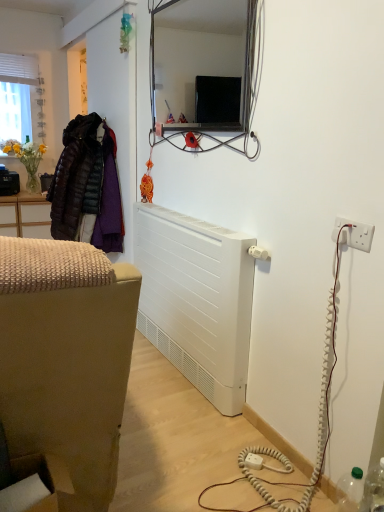
Describe the element at coordinates (87, 186) in the screenshot. This screenshot has height=512, width=384. I see `dark brown quilted jacket at left` at that location.

Find the location of a particular element. white plastic electrical outlet at right is located at coordinates (353, 234).

This screenshot has height=512, width=384. What do you see at coordinates (353, 234) in the screenshot? I see `white plastic electrical outlet at right` at bounding box center [353, 234].

This screenshot has width=384, height=512. Describe the element at coordinates (374, 489) in the screenshot. I see `transparent plastic bottle at lower right` at that location.

Describe the element at coordinates (196, 300) in the screenshot. I see `white matte radiator at lower center` at that location.

Describe the element at coordinates (253, 461) in the screenshot. I see `white plastic plug at lower center` at that location.

Where is `white plastic plug at lower center`? The width and height of the screenshot is (384, 512). white plastic plug at lower center is located at coordinates (253, 461).

Locate an element on the screen. This screenshot has width=384, height=512. dark brown quilted jacket at left is located at coordinates (87, 186).

Looking at this image, between white plastic plug at lower center and white matte radiator at lower center, which one has smaller width?

white plastic plug at lower center is thinner.

Is white plastic plug at lower center inside or outside of white matte radiator at lower center?

white plastic plug at lower center is located beyond the bounds of white matte radiator at lower center.

The height and width of the screenshot is (512, 384). Identify the location of plug that is under the white matte radiator at lower center (from a real-world perspective). (253, 461).

Between white matte radiator at lower center and white plastic plug at lower center, which one has more height?

white matte radiator at lower center is taller.

Measure the distance from white matte radiator at lower center to white plastic plug at lower center.

white matte radiator at lower center is 76.87 centimeters away from white plastic plug at lower center.

Considering the positions of objects white matte radiator at lower center and white plastic plug at lower center in the image provided, who is in front, white matte radiator at lower center or white plastic plug at lower center?

white matte radiator at lower center is closer to the camera.

From a real-world perspective, which object rests below the other?

From a 3D spatial view, white plastic plug at lower center is below.

Considering the positions of point (254, 460) and point (119, 238), is point (254, 460) closer or farther from the camera than point (119, 238)?

Point (254, 460) is closer to the camera than point (119, 238).

Is white plastic electrical outlet at right positioned far away from white plastic plug at lower center?

Actually, white plastic electrical outlet at right and white plastic plug at lower center are a little close together.

Is white plastic electrical outlet at right situated inside white plastic plug at lower center or outside?

white plastic electrical outlet at right is outside white plastic plug at lower center.

Can you confirm if white plastic electrical outlet at right is smaller than white plastic plug at lower center?

Incorrect, white plastic electrical outlet at right is not smaller in size than white plastic plug at lower center.

Visually, is white plastic electrical outlet at right positioned to the left or to the right of white plastic plug at lower center?

In the image, white plastic electrical outlet at right appears on the right side of white plastic plug at lower center.

Between white plastic electrical outlet at right and dark brown quilted jacket at left, which one has smaller size?

white plastic electrical outlet at right.

At what (x,y) coordinates should I click in order to perform the action: click on electric outlet in front of the dark brown quilted jacket at left. Please return your answer as a coordinate pair (x, y). The image size is (384, 512). Looking at the image, I should click on (353, 234).

Considering the sizes of objects white plastic electrical outlet at right and dark brown quilted jacket at left in the image provided, who is taller, white plastic electrical outlet at right or dark brown quilted jacket at left?

dark brown quilted jacket at left.

From the image's perspective, would you say white plastic electrical outlet at right is positioned over dark brown quilted jacket at left?

Actually, white plastic electrical outlet at right appears below dark brown quilted jacket at left in the image.

Can you tell me how much transparent plastic bottle at lower right and metallic frame mirror at upper center differ in facing direction?

There is a 0.0091-degree angle between the facing directions of transparent plastic bottle at lower right and metallic frame mirror at upper center.

In the scene shown: Are transparent plastic bottle at lower right and metallic frame mirror at upper center located far from each other?

transparent plastic bottle at lower right is positioned a significant distance from metallic frame mirror at upper center.

How distant is transparent plastic bottle at lower right from metallic frame mirror at upper center?

4.33 meters.

Considering the relative sizes of transparent plastic bottle at lower right and metallic frame mirror at upper center in the image provided, is transparent plastic bottle at lower right shorter than metallic frame mirror at upper center?

Yes, transparent plastic bottle at lower right is shorter than metallic frame mirror at upper center.

From a real-world perspective, is metallic frame mirror at upper center over white plastic electrical outlet at right?

Yes, from a real-world perspective, metallic frame mirror at upper center is above white plastic electrical outlet at right.

Which of these two, metallic frame mirror at upper center or white plastic electrical outlet at right, is smaller?

white plastic electrical outlet at right.

Which object is further away from the camera, metallic frame mirror at upper center or white plastic electrical outlet at right?

metallic frame mirror at upper center.

In the image, there is a white plastic electrical outlet at right. At what (x,y) coordinates should I click in order to perform the action: click on mirror above it (from the image's perspective). Please return your answer as a coordinate pair (x, y). The width and height of the screenshot is (384, 512). Looking at the image, I should click on (200, 65).

Where is `plug beneath the white matte radiator at lower center (from a real-world perspective)`? This screenshot has width=384, height=512. plug beneath the white matte radiator at lower center (from a real-world perspective) is located at coordinates (253, 461).

This screenshot has height=512, width=384. What are the coordinates of `radiator that is above the white plastic plug at lower center (from the image's perspective)` in the screenshot? It's located at (196, 300).

Looking at the image, which one is located further to white plastic plug at lower center, white matte radiator at lower center or dark brown quilted jacket at left?

dark brown quilted jacket at left.

Based on their spatial positions, is white matte radiator at lower center or metallic frame mirror at upper center closer to dark brown quilted jacket at left?

white matte radiator at lower center is positioned closer to the anchor dark brown quilted jacket at left.

Considering their positions, is white plastic electrical outlet at right positioned further to white plastic plug at lower center than white matte radiator at lower center?

white plastic electrical outlet at right is positioned further to the anchor white plastic plug at lower center.

Looking at the image, which one is located further to white plastic electrical outlet at right, metallic frame mirror at upper center or dark brown quilted jacket at left?

metallic frame mirror at upper center is further to white plastic electrical outlet at right.

Estimate the real-world distances between objects in this image. Which object is closer to white plastic electrical outlet at right, transparent plastic bottle at lower right or dark brown quilted jacket at left?

transparent plastic bottle at lower right lies closer to white plastic electrical outlet at right than the other object.

From the image, which object appears to be nearer to transparent plastic bottle at lower right, dark brown quilted jacket at left or white plastic electrical outlet at right?

The object closer to transparent plastic bottle at lower right is white plastic electrical outlet at right.

Considering their positions, is metallic frame mirror at upper center positioned closer to dark brown quilted jacket at left than white plastic plug at lower center?

metallic frame mirror at upper center is positioned closer to the anchor dark brown quilted jacket at left.

From the image, which object appears to be nearer to white plastic plug at lower center, transparent plastic bottle at lower right or white plastic electrical outlet at right?

Based on the image, transparent plastic bottle at lower right appears to be nearer to white plastic plug at lower center.

At what (x,y) coordinates should I click in order to perform the action: click on radiator between metallic frame mirror at upper center and dark brown quilted jacket at left from front to back. Please return your answer as a coordinate pair (x, y). Looking at the image, I should click on (196, 300).

Identify the location of electric outlet between transparent plastic bottle at lower right and dark brown quilted jacket at left from front to back. Image resolution: width=384 pixels, height=512 pixels. (353, 234).

Where is `radiator between white plastic electrical outlet at right and transparent plastic bottle at lower right from top to bottom`? radiator between white plastic electrical outlet at right and transparent plastic bottle at lower right from top to bottom is located at coordinates (196, 300).

At what (x,y) coordinates should I click in order to perform the action: click on radiator between metallic frame mirror at upper center and transparent plastic bottle at lower right vertically. Please return your answer as a coordinate pair (x, y). The width and height of the screenshot is (384, 512). Looking at the image, I should click on (196, 300).